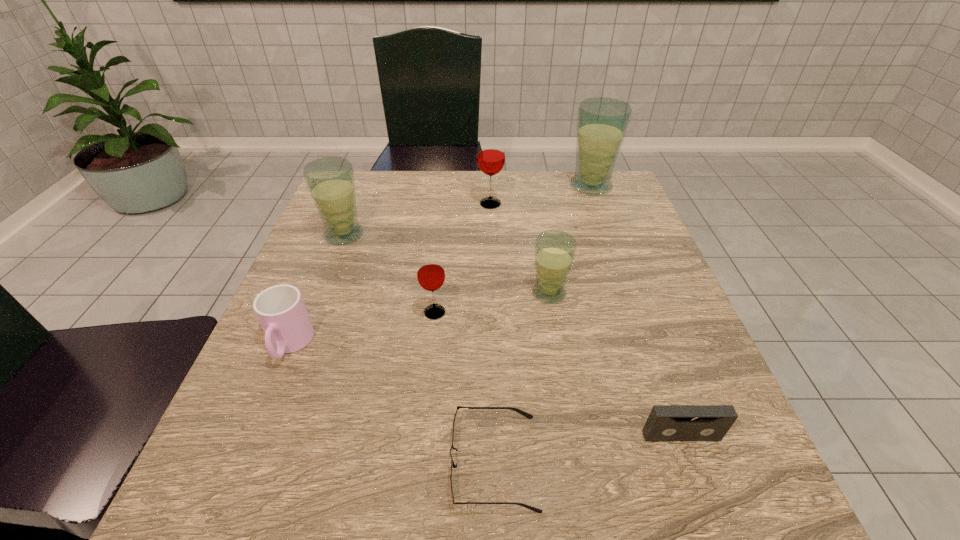
Find the location of a particular element. This screenshot has height=540, width=960. vacant space located 0.070m on the front-facing side of the videotape is located at coordinates (700, 488).

Where is `vacant space located 0.280m on the front-facing side of the spectacles`? The image size is (960, 540). vacant space located 0.280m on the front-facing side of the spectacles is located at coordinates (261, 462).

Where is `vacant region located on the front-facing side of the spectacles`? vacant region located on the front-facing side of the spectacles is located at coordinates (234, 462).

You are a GUI agent. You are given a task and a screenshot of the screen. Output one action in this format:
    pyautogui.click(x=<x>, y=<y>)
    Task: Click on the free spot located on the front-facing side of the spectacles
    The height and width of the screenshot is (540, 960).
    Given the screenshot: What is the action you would take?
    pyautogui.click(x=221, y=462)

Where is `object that is at the near edge`? object that is at the near edge is located at coordinates (529, 416).

Find the location of a particular element. This screenshot has height=540, width=960. glass that is at the left edge is located at coordinates (330, 181).

What are the coordinates of `cup present at the left edge` in the screenshot? It's located at (280, 309).

I want to click on glass that is at the right edge, so click(x=602, y=122).

Locate an element on the screen. This screenshot has height=540, width=960. videotape located at the right edge is located at coordinates (665, 422).

Where is `object present at the far right corner`? This screenshot has width=960, height=540. object present at the far right corner is located at coordinates (602, 122).